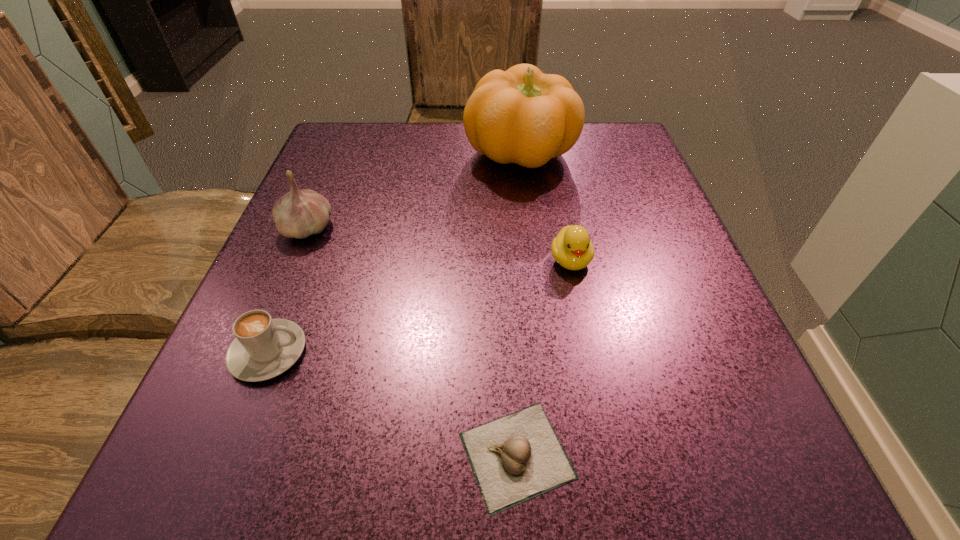
At what (x,y) coordinates should I click in order to perform the action: click on free region at the far edge of the desktop. Please return your answer as a coordinate pair (x, y). Looking at the image, I should click on (487, 176).

The width and height of the screenshot is (960, 540). Identify the location of free space at the near edge of the desktop. (600, 456).

Locate an element on the screen. vacant space at the left edge of the desktop is located at coordinates (345, 249).

Find the location of a particular element. This screenshot has height=540, width=960. vacant space at the right edge is located at coordinates (629, 188).

What are the coordinates of `vacant space at the far left corner` in the screenshot? It's located at (332, 174).

In the image, there is a desktop. Where is `free space at the near right corner`? free space at the near right corner is located at coordinates (801, 500).

Identify the location of unoccupied position between the farthest object and the shorter garlic. (518, 305).

Identify the location of vacant space that's between the tallest object and the duckling. The height and width of the screenshot is (540, 960). (545, 207).

Find the location of a particular element. This screenshot has height=540, width=960. free space between the shorter garlic and the fourth tallest object is located at coordinates (393, 403).

Image resolution: width=960 pixels, height=540 pixels. What are the coordinates of `free point between the third tallest object and the shortest object` in the screenshot? It's located at click(543, 357).